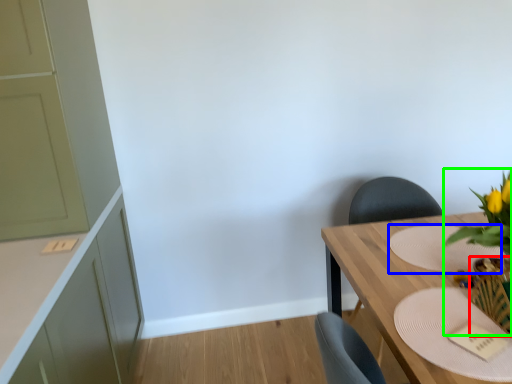
Question: Which is farther away from vase (highlighted by a red box)? plate (highlighted by a blue box) or floral arrangement (highlighted by a green box)?

Choices:
 (A) plate
 (B) floral arrangement

Answer: (A)